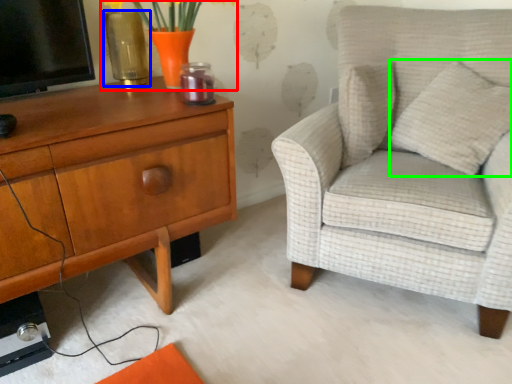
Question: Considering the real-world distances, which object is farthest from floral arrangement (highlighted by a red box)? vase (highlighted by a blue box) or pillow (highlighted by a green box)?

Choices:
 (A) vase
 (B) pillow

Answer: (B)